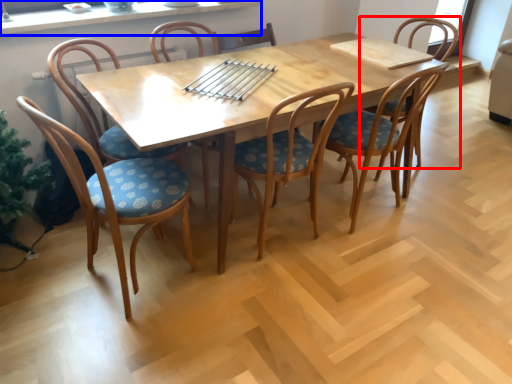
Question: Which object is further to the camera taking this photo, chair (highlighted by a red box) or window sill (highlighted by a blue box)?

Choices:
 (A) chair
 (B) window sill

Answer: (A)